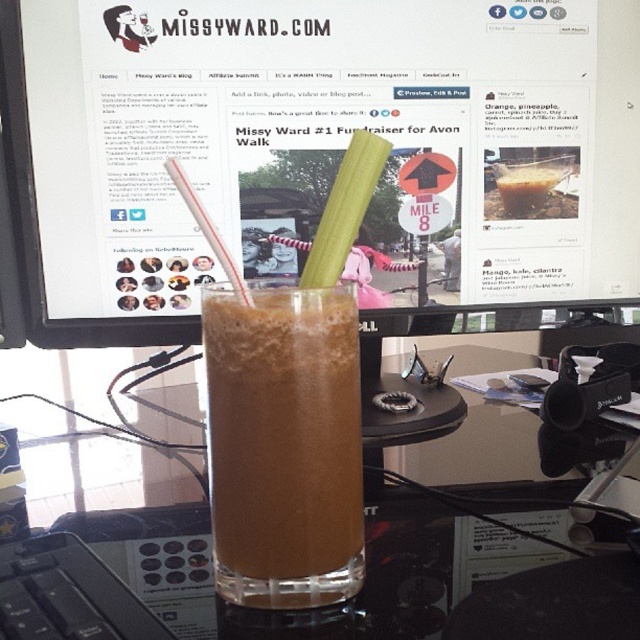
Question: Which of the following is the farthest from the observer?

Choices:
 (A) brown frothy drink at center
 (B) translucent plastic straw at center

Answer: (A)

Question: Estimate the real-world distances between objects in this image. Which object is farther from the green crisp celery at center?

Choices:
 (A) matte plastic computer monitor at center
 (B) translucent plastic straw at center

Answer: (A)

Question: Which object appears farthest from the camera in this image?

Choices:
 (A) translucent plastic straw at center
 (B) matte plastic computer monitor at center

Answer: (B)

Question: Does translucent plastic cup at center lie behind brown frothy drink at center?

Choices:
 (A) yes
 (B) no

Answer: (B)

Question: Is brown frothy drink at center closer to the viewer compared to green crisp celery at center?

Choices:
 (A) yes
 (B) no

Answer: (A)

Question: Can you confirm if brown frothy drink at center is positioned to the left of green crisp celery at center?

Choices:
 (A) no
 (B) yes

Answer: (B)